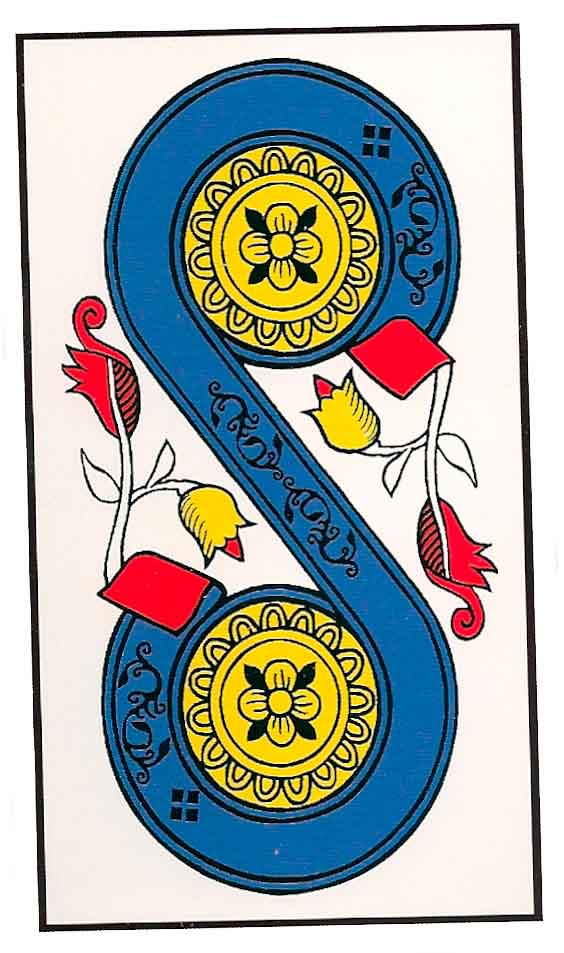
Identify the location of scrollwork. This screenshot has width=564, height=953. click(x=420, y=240), click(x=147, y=700), click(x=136, y=759), click(x=252, y=459), click(x=323, y=537).